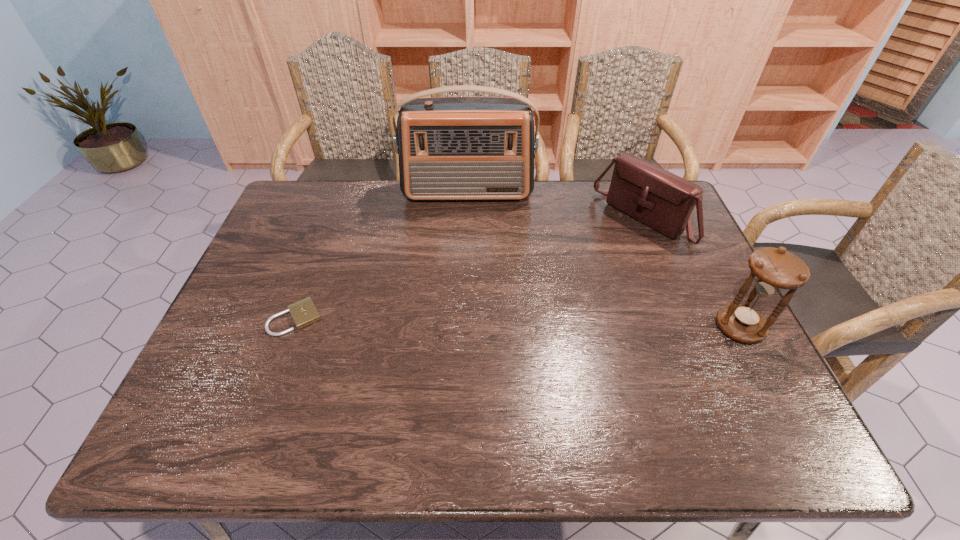
Image resolution: width=960 pixels, height=540 pixels. Find the location of `the leftmost object`. the leftmost object is located at coordinates (304, 312).

Locate an element on the screen. the shortest object is located at coordinates (304, 312).

The height and width of the screenshot is (540, 960). Identify the location of hourglass. (773, 270).

The height and width of the screenshot is (540, 960). I want to click on the tallest object, so click(450, 148).

This screenshot has height=540, width=960. Find the location of `radio receiver`. radio receiver is located at coordinates (450, 148).

You are a GUI agent. You are given a task and a screenshot of the screen. Output one action in this format:
    pyautogui.click(x=<x>, y=<y>)
    Task: Click on the shoulder bag
    
    Given the screenshot: What is the action you would take?
    pyautogui.click(x=663, y=201)

Identify the location of free space located 0.160m on the back of the leftmost object. Image resolution: width=960 pixels, height=540 pixels. (318, 259).

Image resolution: width=960 pixels, height=540 pixels. In order to click on free space located 0.150m on the left of the third shortest object in this screenshot , I will do `click(656, 327)`.

Locate an element on the screen. The height and width of the screenshot is (540, 960). free space located on the front-facing side of the third object from right to left is located at coordinates (467, 244).

Where is `vacant space located 0.160m on the front-facing side of the third object from right to left`? vacant space located 0.160m on the front-facing side of the third object from right to left is located at coordinates (468, 238).